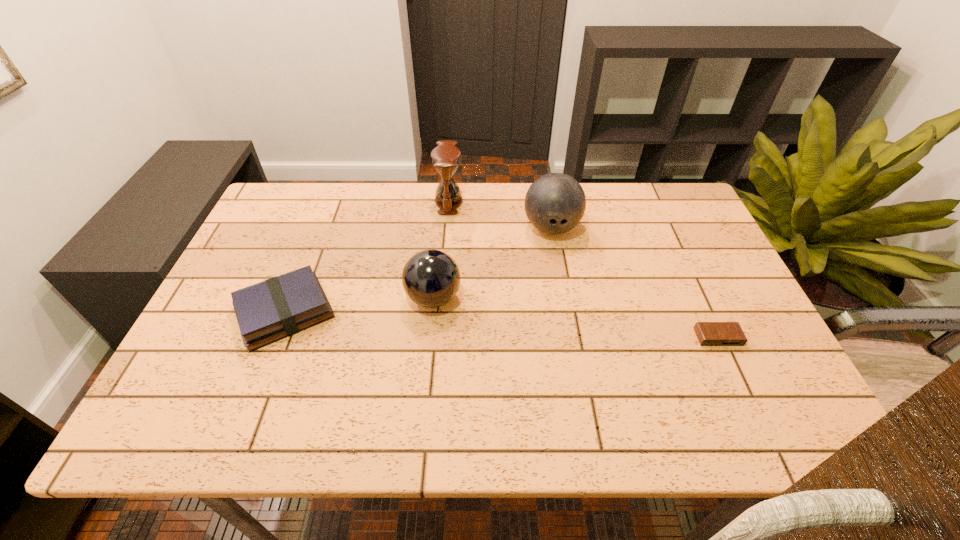
The image size is (960, 540). What are the coordinates of `hourglass` in the screenshot? It's located at (445, 157).

Identify the location of the right bowling ball. (555, 203).

Locate an element on the screen. the second object from right to left is located at coordinates (555, 203).

This screenshot has width=960, height=540. Identify the location of the left bowling ball. (431, 278).

Identify the location of the shorter bowling ball. This screenshot has width=960, height=540. pyautogui.click(x=431, y=278).

Find the location of `the fourth tallest object`. the fourth tallest object is located at coordinates (279, 307).

Where is `the leftmost object`? Image resolution: width=960 pixels, height=540 pixels. the leftmost object is located at coordinates (279, 307).

Find the location of a particular element. This screenshot has width=960, height=540. the rightmost object is located at coordinates (708, 333).

Find the location of `alarm clock`. alarm clock is located at coordinates (708, 333).

Locate an element on the screen. The width and height of the screenshot is (960, 540). free space located 0.180m on the left of the hourglass is located at coordinates (378, 201).